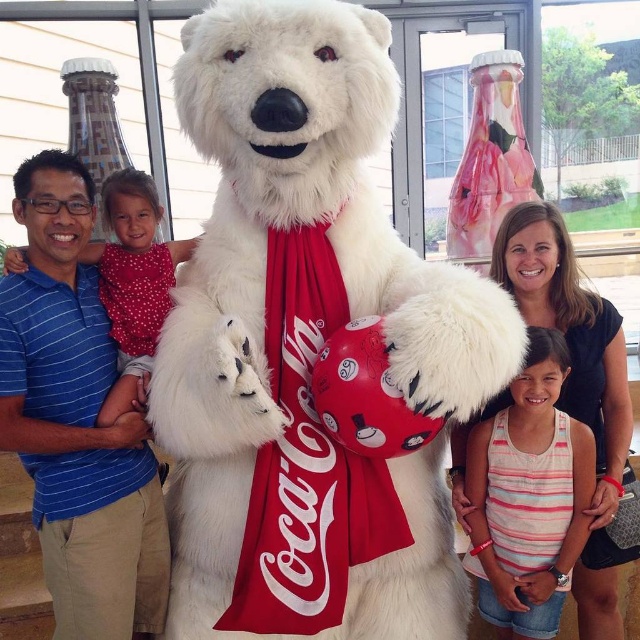
You are a photographer at the event and need to ensure all subjects are in focus. Since the striped tank top at center and the white fluffy bear at upper left are in the frame, which one should you prioritize focusing on first to ensure clarity?

The striped tank top at center is bigger than the white fluffy bear at upper left, so you should prioritize focusing on the striped tank top at center first to ensure clarity.

In the photo, there are a striped tank top at center and a white fluffy bear at upper left. Based on their positions, which one is closer to the right edge of the image?

The striped tank top at center is to the right of the white fluffy bear at upper left, so the striped tank top at center is closer to the right edge of the image.

In the scene described, there is a white plush teddy bear at center. What object is located at the coordinates point (308, 344)?

The point (308, 344) corresponds to the white plush teddy bear at center.